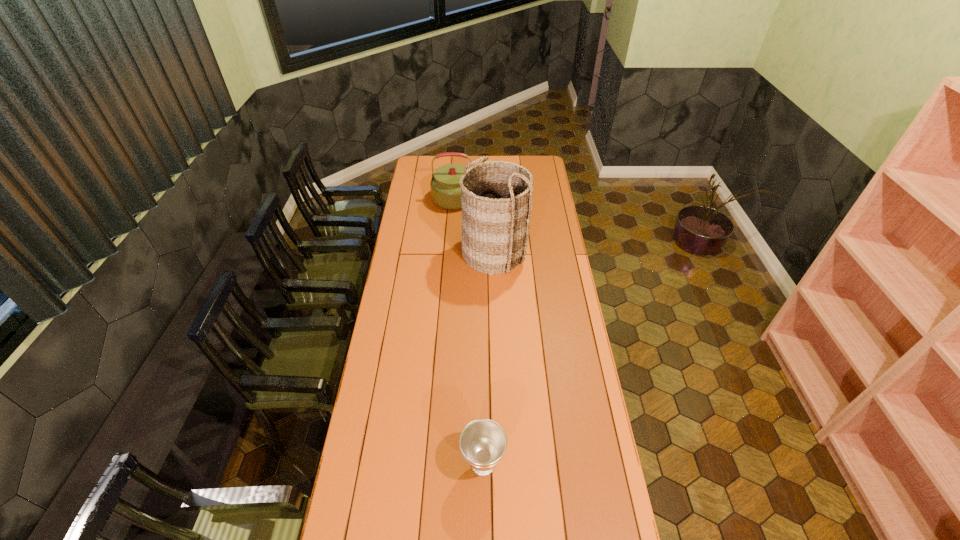
In the image, there is a desktop. Where is `free region at the left edge`? The width and height of the screenshot is (960, 540). free region at the left edge is located at coordinates (385, 457).

This screenshot has width=960, height=540. I want to click on free region at the right edge of the desktop, so click(536, 183).

Where is `vacant region at the far left corner of the desktop`? Image resolution: width=960 pixels, height=540 pixels. vacant region at the far left corner of the desktop is located at coordinates (418, 174).

Locate an element on the screen. Image resolution: width=960 pixels, height=540 pixels. vacant area that lies between the second nearest object and the shortest object is located at coordinates (489, 358).

I want to click on vacant region between the shortest object and the basket, so click(x=489, y=358).

Identify the location of free space between the farthest object and the chalice. Image resolution: width=960 pixels, height=540 pixels. (471, 332).

Locate which object ranks in proximity to the chalice. Please provide its 2D coordinates. Your answer should be formatted as a tuple, i.e. [(x, y)], where the tuple contains the x and y coordinates of a point satisfying the conditions above.

[(496, 196)]

At what (x,y) coordinates should I click in order to perform the action: click on object that stands as the second closest to the farthest object. Please return your answer as a coordinate pair (x, y). This screenshot has height=540, width=960. Looking at the image, I should click on (483, 442).

The height and width of the screenshot is (540, 960). I want to click on free spot that satisfies the following two spatial constraints: 1. on the back side of the shortest object; 2. at the spout of the second shortest object, so click(482, 199).

Find the location of a particular element. Image resolution: width=960 pixels, height=540 pixels. free space that satisfies the following two spatial constraints: 1. at the spout of the second tallest object; 2. on the right side of the nearest object is located at coordinates (446, 464).